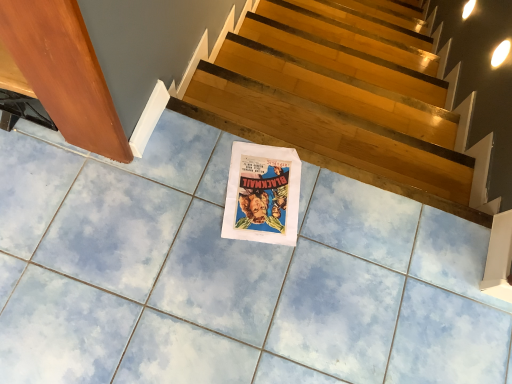
Find the location of `space that is in front of white paper at center`. space that is in front of white paper at center is located at coordinates (238, 274).